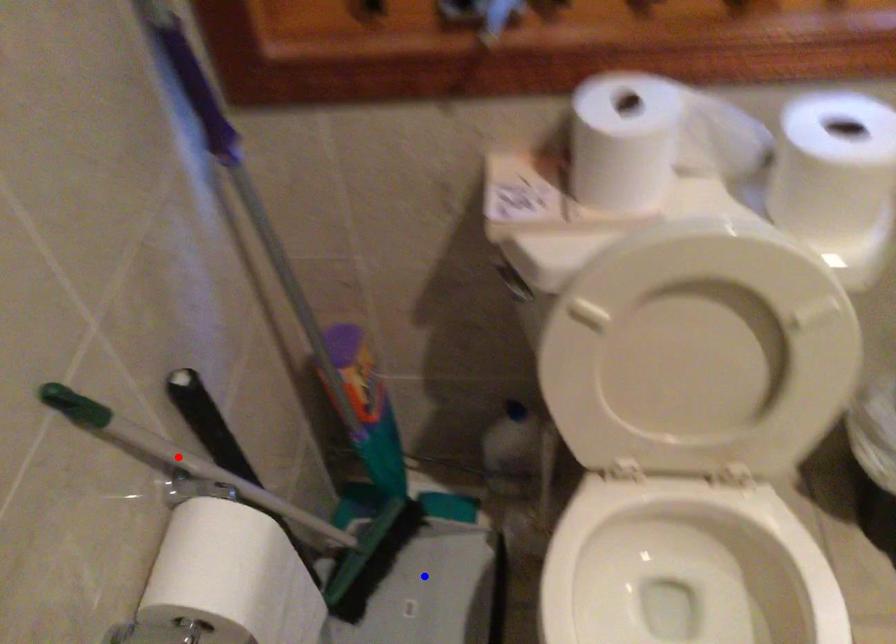
Question: In the image, two points are highlighted. Which point is nearer to the camera? Reply with the corresponding letter.

Choices:
 (A) blue point
 (B) red point

Answer: (B)